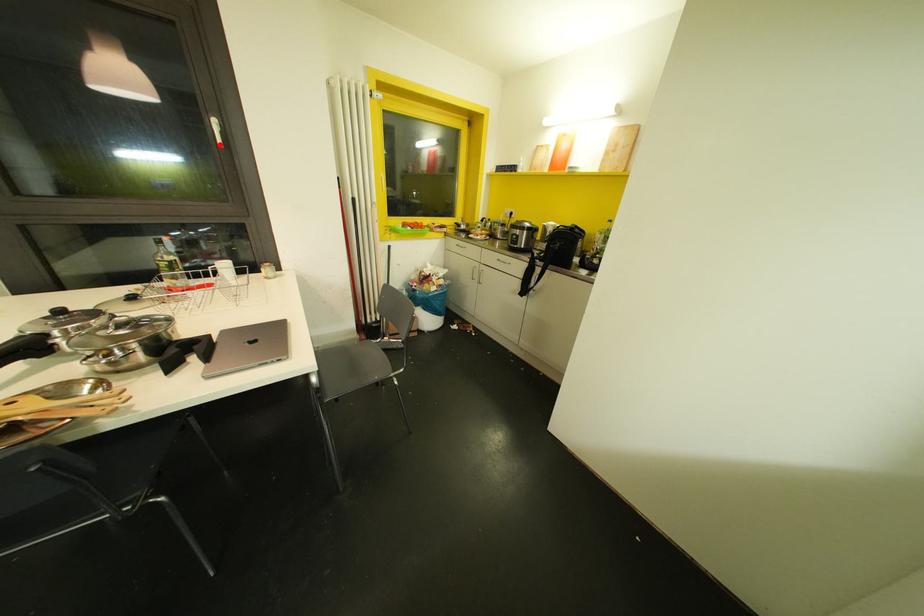
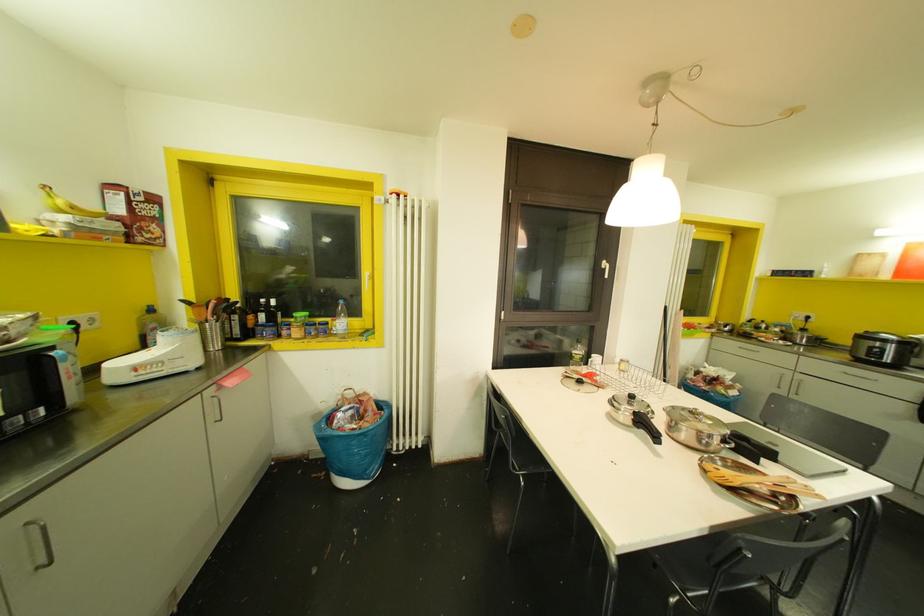
Find the pixel in the second image that matches the highlighted location in the first image.

(605, 276)